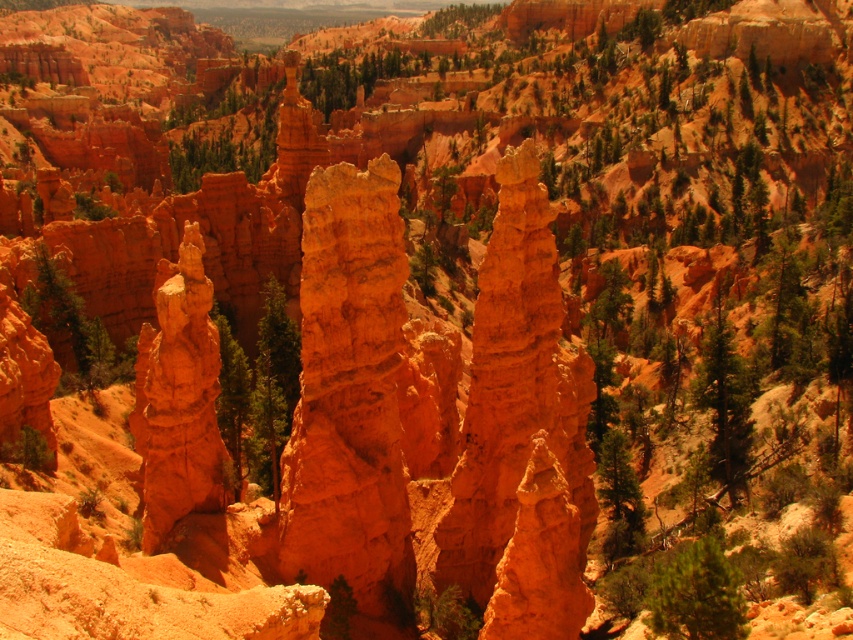
You are standing at the base of the orange sandstone hoodoo at center and want to take a photo of the green textured tree at lower right. Which direction should you face to capture both the tree and the hoodoo in the same frame?

You should face downward because the orange sandstone hoodoo at center is located above the green textured tree at lower right, so facing downward will allow you to capture both in the same frame.

You are standing at the edge of the canyon and notice two green textured tree at lower right and green textured tree at right. Which one is positioned lower in the scene?

The green textured tree at lower right is positioned lower in the scene than the green textured tree at right.

Based on the scene description, what does the point at coordinates (x=178, y=397) represent?

The point at coordinates (x=178, y=397) marks an orange sandstone hoodoo located at the center of the scene.